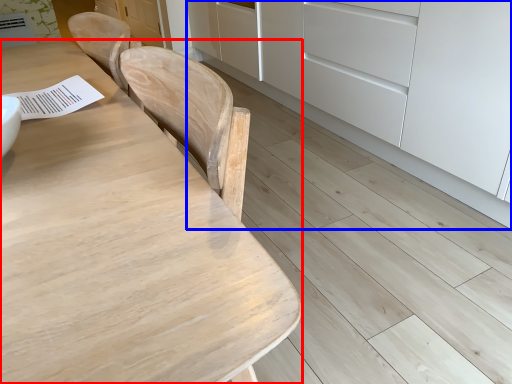
Question: Which point is further to the camera, table (highlighted by a red box) or cabinetry (highlighted by a blue box)?

Choices:
 (A) table
 (B) cabinetry

Answer: (B)